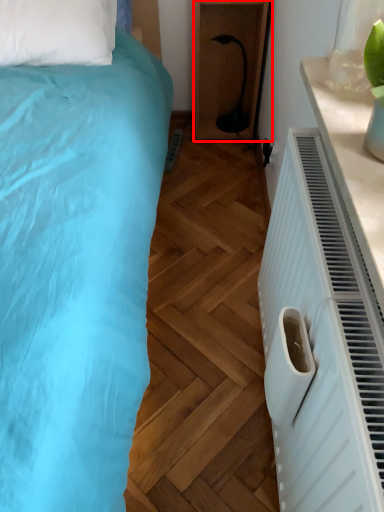
Question: From the image's perspective, what is the correct spatial relationship of furniture (annotated by the red box) in relation to electric outlet?

Choices:
 (A) above
 (B) below

Answer: (A)